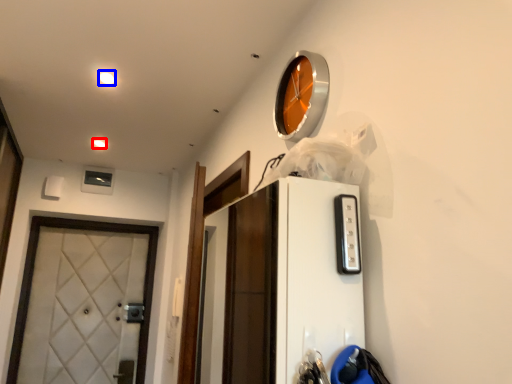
Question: Which of the following is the farthest to the observer, light (highlighted by a red box) or light (highlighted by a blue box)?

Choices:
 (A) light
 (B) light

Answer: (A)